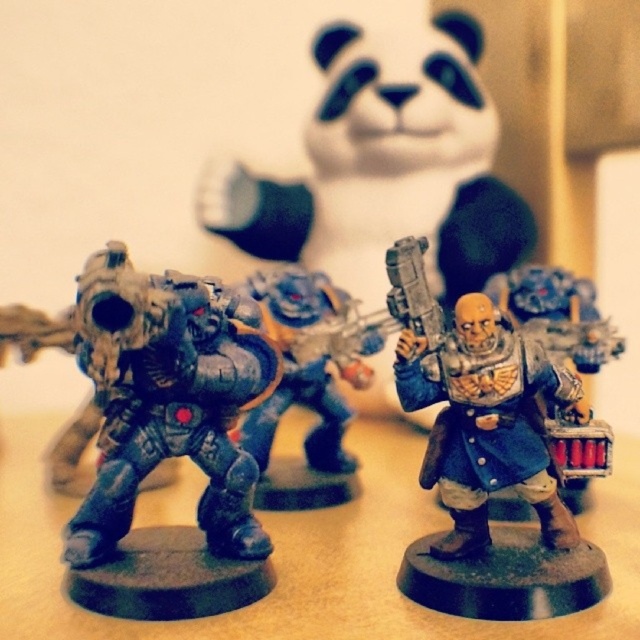
You are a tiny robot navigating between the two points on the wooden surface. The first point is at coordinates point (452, 355) and the second is at point (579, 339). Since you can only move forward, which point should you aim for to stay closer to the foreground figures?

You should aim for point (452, 355) because it is in front of point (579, 339), making it closer to the foreground figures.

You are organizing a display of miniature figurines on a wooden table. You have two figures to place next to each other on the table. The first is the matte blue armor at center, and the second is the matte black figure at center. According to the scene description, which figure should you place closer to the front of the table to maintain the original arrangement?

You should place the matte blue armor at center closer to the front of the table because it is in front of the matte black figure at center in the original scene.

You are a collector who wants to place a new 10 inch wide decorative item between the metallic blue figure at center and the matte black figure at center. Based on the current spacing between them, will there be enough space for the item without moving the existing figures?

The metallic blue figure at center and the matte black figure at center are 17.23 inches apart. Since the decorative item is only 10 inches wide, there is sufficient space between them to place the item without moving the existing figures.